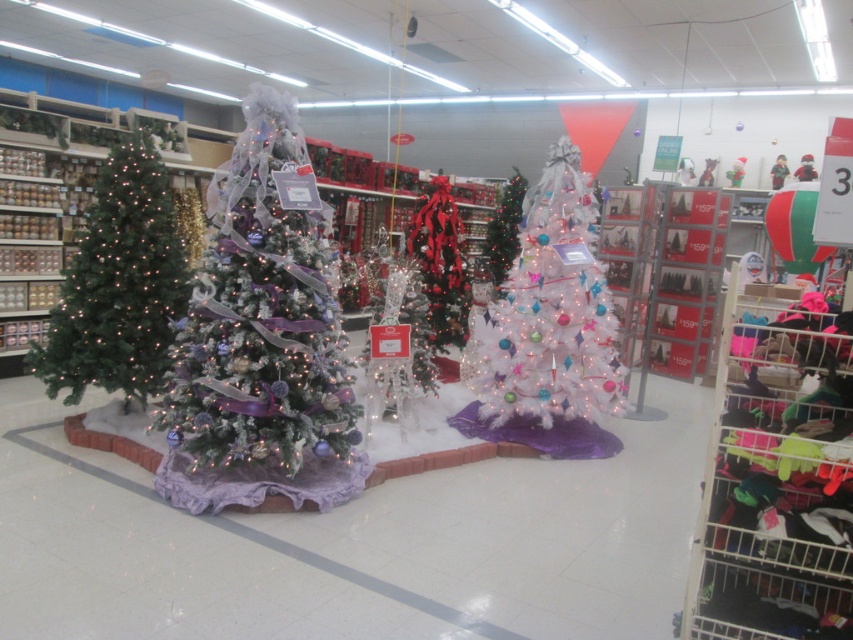
Question: Considering the real-world distances, which object is closest to the white glittery christmas tree at center?

Choices:
 (A) green matte christmas tree at left
 (B) white frosted christmas tree at center

Answer: (A)

Question: Which object is closer to the camera taking this photo?

Choices:
 (A) white frosted christmas tree at center
 (B) shiny red ribbon at center

Answer: (B)

Question: In this image, where is white glittery christmas tree at center located relative to white glossy christmas tree at center?

Choices:
 (A) left
 (B) right

Answer: (A)

Question: Which object is farther from the camera taking this photo?

Choices:
 (A) green matte christmas tree at left
 (B) white glittery christmas tree at center
 (C) white frosted christmas tree at center
 (D) white glossy christmas tree at center

Answer: (C)

Question: Is white glossy christmas tree at center to the left of white frosted christmas tree at center from the viewer's perspective?

Choices:
 (A) no
 (B) yes

Answer: (B)

Question: Does white glittery christmas tree at center come in front of green matte christmas tree at left?

Choices:
 (A) no
 (B) yes

Answer: (B)